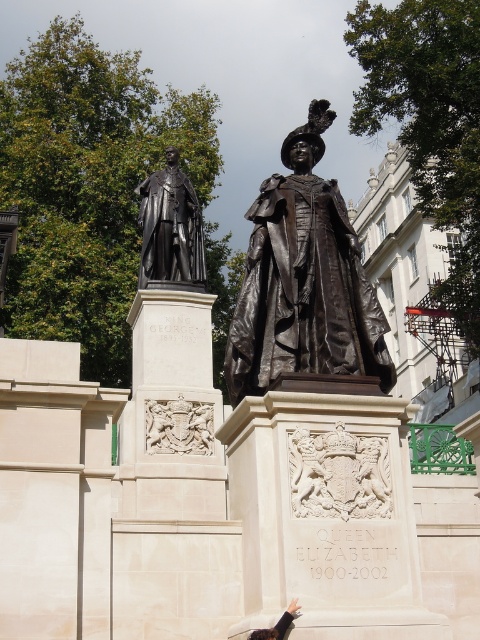
Question: Which object appears farthest from the camera in this image?

Choices:
 (A) bronze statue at center
 (B) bronze statue at left
 (C) black leather glove at lower center

Answer: (B)

Question: Does bronze statue at center come in front of bronze statue at left?

Choices:
 (A) no
 (B) yes

Answer: (B)

Question: Estimate the real-world distances between objects in this image. Which object is farther from the black leather glove at lower center?

Choices:
 (A) bronze statue at center
 (B) bronze statue at left

Answer: (B)

Question: In this image, where is bronze statue at center located relative to bronze statue at left?

Choices:
 (A) below
 (B) above

Answer: (A)

Question: Estimate the real-world distances between objects in this image. Which object is farther from the bronze statue at left?

Choices:
 (A) black leather glove at lower center
 (B) bronze statue at center

Answer: (A)

Question: Is bronze statue at left to the right of black leather glove at lower center from the viewer's perspective?

Choices:
 (A) no
 (B) yes

Answer: (A)